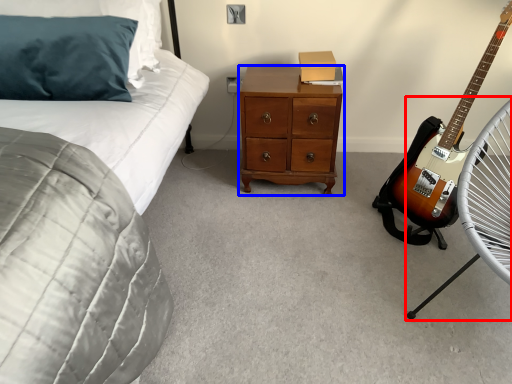
Question: Which of the following is the closest to the observer, folding chair (highlighted by a red box) or chest of drawers (highlighted by a blue box)?

Choices:
 (A) folding chair
 (B) chest of drawers

Answer: (A)